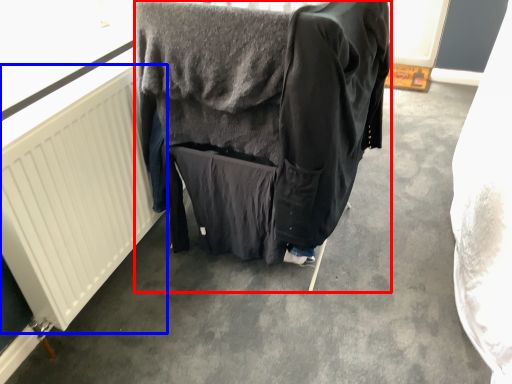
Question: Which object appears closest to the camera in this image, furniture (highlighted by a red box) or radiator (highlighted by a blue box)?

Choices:
 (A) furniture
 (B) radiator

Answer: (B)